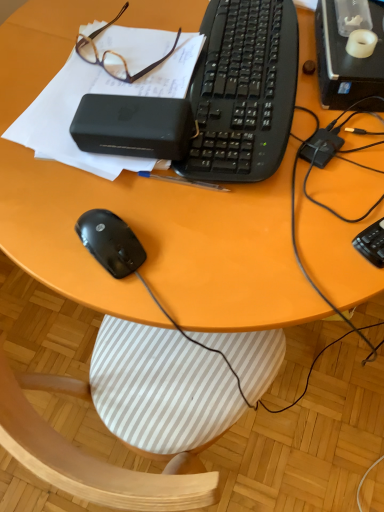
You are a GUI agent. You are given a task and a screenshot of the screen. Output one action in this format:
    pyautogui.click(x=<x>, y=<y>)
    Task: Click on the unoccupied area behind black matte mouse at lower left
    This screenshot has width=384, height=512.
    Given the screenshot: What is the action you would take?
    pyautogui.click(x=97, y=186)